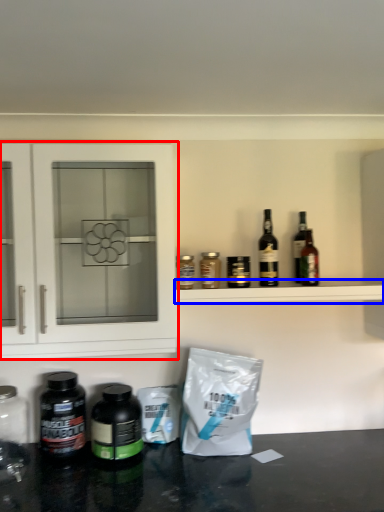
Question: Which point is further to the camera, cabinetry (highlighted by a red box) or shelf (highlighted by a blue box)?

Choices:
 (A) cabinetry
 (B) shelf

Answer: (B)